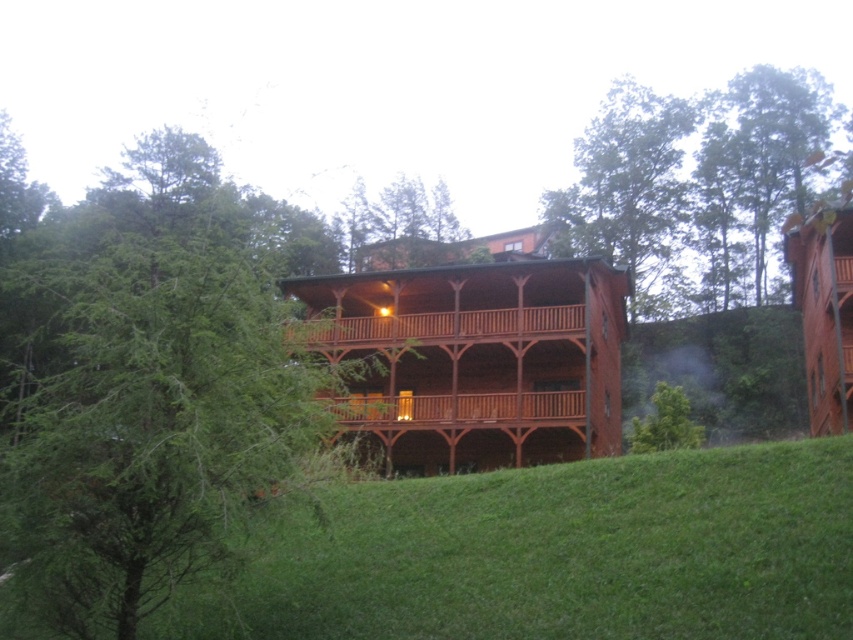
Question: In this image, where is wooden at center located relative to green leafy tree at lower center?

Choices:
 (A) left
 (B) right

Answer: (A)

Question: Among these objects, which one is farthest from the camera?

Choices:
 (A) green leafy tree at upper center
 (B) wooden at center

Answer: (A)

Question: Does wooden balcony at center have a greater width compared to green leafy tree at lower center?

Choices:
 (A) no
 (B) yes

Answer: (B)

Question: Among these objects, which one is nearest to the camera?

Choices:
 (A) green leafy tree at upper right
 (B) wooden balcony at center

Answer: (B)

Question: Which point is farther from the camera taking this photo?

Choices:
 (A) (235, 385)
 (B) (677, 406)
 (C) (695, 104)
 (D) (354, 426)

Answer: (C)

Question: Can you confirm if green leafy tree at upper right is smaller than green leafy tree at lower center?

Choices:
 (A) yes
 (B) no

Answer: (B)